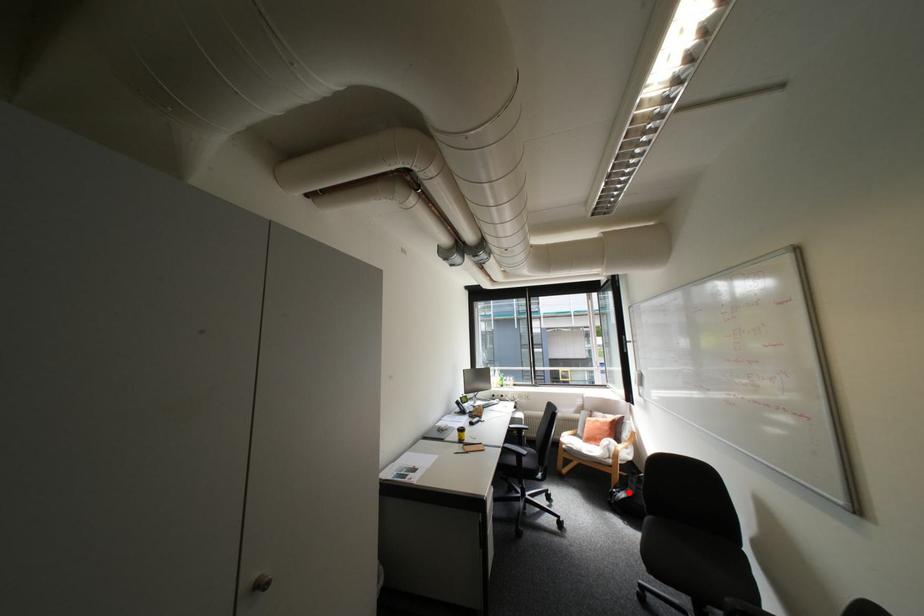
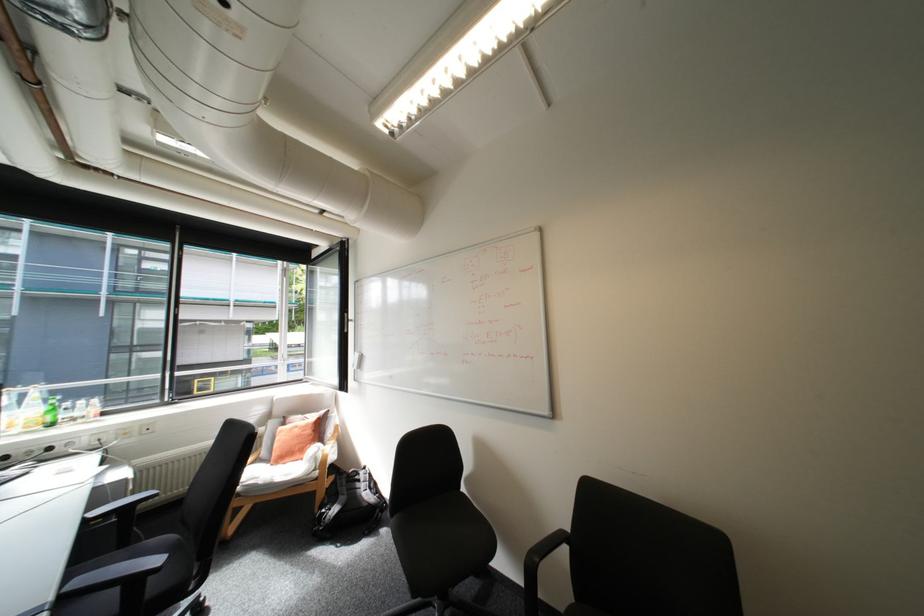
Question: I am providing you with two images of the same scene from different viewpoints. A red point is marked on the first image. At the location where the point appears in image 1, is it still visible in image 2?

Choices:
 (A) Yes
 (B) No

Answer: (A)